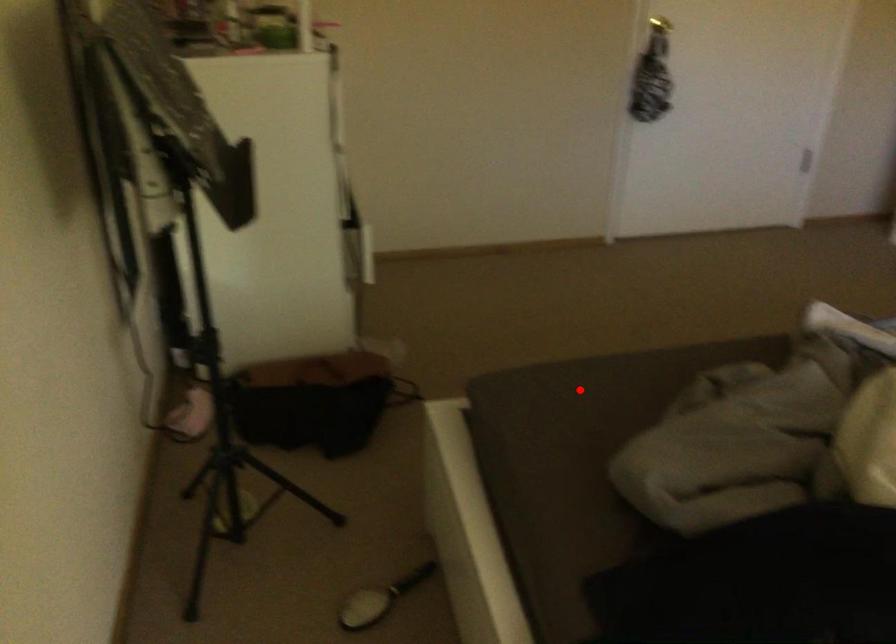
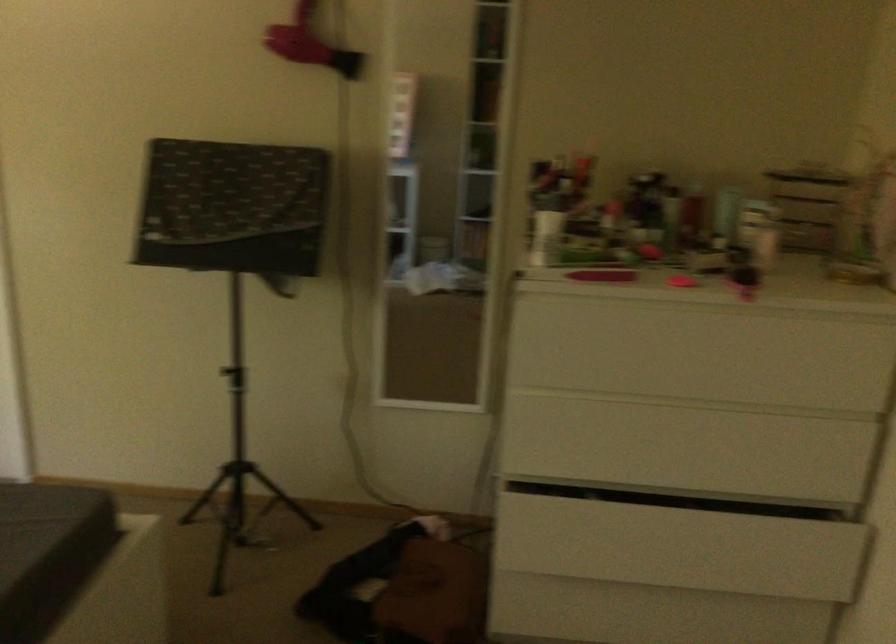
The point at the highlighted location is marked in the first image. Where is the corresponding point in the second image?

(38, 523)